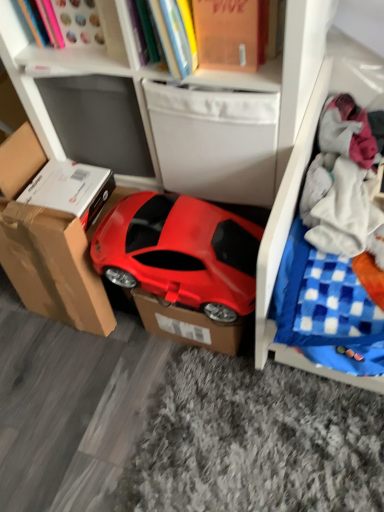
Question: Is matte white bookcase at upper center wider than orange matte book at upper center?

Choices:
 (A) no
 (B) yes

Answer: (B)

Question: Is matte white bookcase at upper center far away from orange matte book at upper center?

Choices:
 (A) yes
 (B) no

Answer: (B)

Question: Considering the relative sizes of matte white bookcase at upper center and orange matte book at upper center in the image provided, is matte white bookcase at upper center smaller than orange matte book at upper center?

Choices:
 (A) no
 (B) yes

Answer: (A)

Question: Does matte white bookcase at upper center turn towards orange matte book at upper center?

Choices:
 (A) no
 (B) yes

Answer: (A)

Question: Is orange matte book at upper center a part of matte white bookcase at upper center?

Choices:
 (A) no
 (B) yes

Answer: (B)

Question: Is matte white bookcase at upper center positioned with its back to orange matte book at upper center?

Choices:
 (A) yes
 (B) no

Answer: (B)

Question: Is brown cardboard box at left, the first cardboard box positioned from the left, positioned in front of orange matte book at upper center?

Choices:
 (A) yes
 (B) no

Answer: (B)

Question: Considering the relative sizes of brown cardboard box at left, the first cardboard box positioned from the left, and orange matte book at upper center in the image provided, is brown cardboard box at left, the first cardboard box positioned from the left, bigger than orange matte book at upper center?

Choices:
 (A) yes
 (B) no

Answer: (B)

Question: Is brown cardboard box at left, arranged as the second cardboard box when viewed from the right, surrounding orange matte book at upper center?

Choices:
 (A) no
 (B) yes

Answer: (A)

Question: From a real-world perspective, is brown cardboard box at left, arranged as the second cardboard box when viewed from the right, below orange matte book at upper center?

Choices:
 (A) no
 (B) yes

Answer: (B)

Question: Can you confirm if brown cardboard box at left, arranged as the second cardboard box when viewed from the right, is positioned to the left of orange matte book at upper center?

Choices:
 (A) no
 (B) yes

Answer: (B)

Question: Considering the relative sizes of brown cardboard box at left, the first cardboard box positioned from the left, and orange matte book at upper center in the image provided, is brown cardboard box at left, the first cardboard box positioned from the left, thinner than orange matte book at upper center?

Choices:
 (A) no
 (B) yes

Answer: (B)

Question: Does white plastic cabinet at upper center have a larger size compared to white soft fabric at right?

Choices:
 (A) no
 (B) yes

Answer: (B)